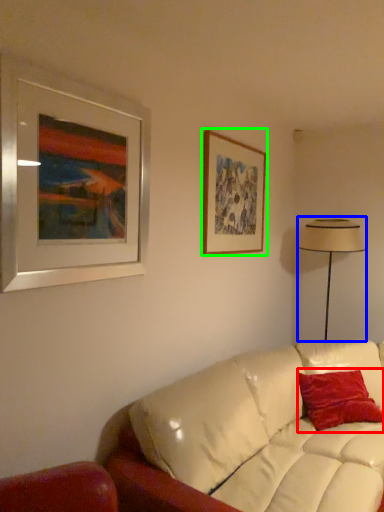
Question: Estimate the real-world distances between objects in this image. Which object is farther from pillow (highlighted by a red box), table lamp (highlighted by a blue box) or picture frame (highlighted by a green box)?

Choices:
 (A) table lamp
 (B) picture frame

Answer: (B)